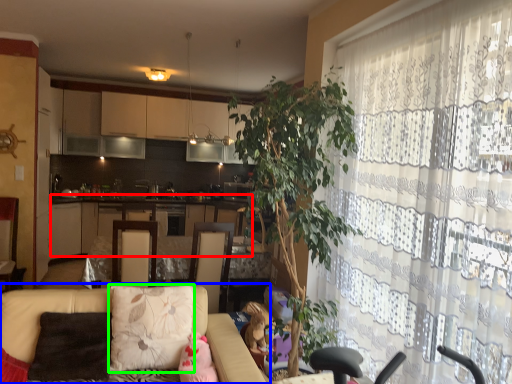
Question: Which is farther away from cabinetry (highlighted by a red box)? studio couch (highlighted by a blue box) or pillow (highlighted by a green box)?

Choices:
 (A) studio couch
 (B) pillow

Answer: (A)